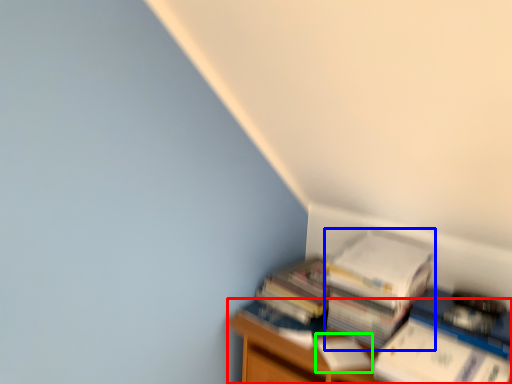
Question: Based on their relative distances, which object is nearer to furniture (highlighted by a red box)? Choose from paperback book (highlighted by a blue box) and paperback book (highlighted by a green box).

Choices:
 (A) paperback book
 (B) paperback book

Answer: (B)